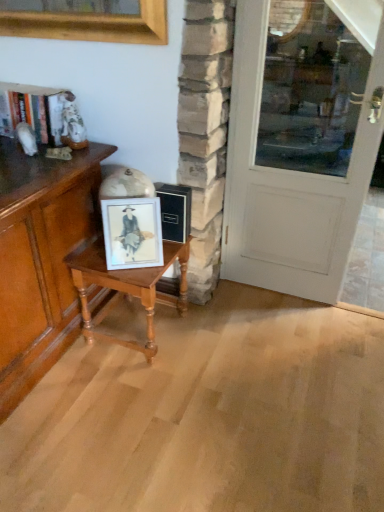
Question: Should I look upward or downward to see matte white frame at center?

Choices:
 (A) down
 (B) up

Answer: (B)

Question: From the image's perspective, is matte wood cabinet at left over matte white frame at center?

Choices:
 (A) no
 (B) yes

Answer: (A)

Question: From the image's perspective, would you say matte wood cabinet at left is shown under matte white frame at center?

Choices:
 (A) yes
 (B) no

Answer: (A)

Question: Considering the relative sizes of matte wood cabinet at left and matte white frame at center in the image provided, is matte wood cabinet at left smaller than matte white frame at center?

Choices:
 (A) no
 (B) yes

Answer: (A)

Question: Is matte wood cabinet at left closer to the viewer compared to matte white frame at center?

Choices:
 (A) no
 (B) yes

Answer: (B)

Question: Is matte wood cabinet at left to the left of matte white frame at center from the viewer's perspective?

Choices:
 (A) yes
 (B) no

Answer: (A)

Question: Is matte wood cabinet at left wider than matte white frame at center?

Choices:
 (A) yes
 (B) no

Answer: (A)

Question: Is matte wood cabinet at left further to the viewer compared to white painted wood door at right?

Choices:
 (A) no
 (B) yes

Answer: (A)

Question: Can you confirm if matte wood cabinet at left is shorter than white painted wood door at right?

Choices:
 (A) yes
 (B) no

Answer: (A)

Question: From the image's perspective, would you say matte wood cabinet at left is positioned over white painted wood door at right?

Choices:
 (A) yes
 (B) no

Answer: (B)

Question: Does matte wood cabinet at left have a larger size compared to white painted wood door at right?

Choices:
 (A) no
 (B) yes

Answer: (B)

Question: Would you say white painted wood door at right is part of matte wood cabinet at left's contents?

Choices:
 (A) no
 (B) yes

Answer: (A)

Question: Is matte wood cabinet at left outside of white painted wood door at right?

Choices:
 (A) yes
 (B) no

Answer: (A)

Question: Can you confirm if matte white frame at center is taller than white painted wood door at right?

Choices:
 (A) no
 (B) yes

Answer: (A)